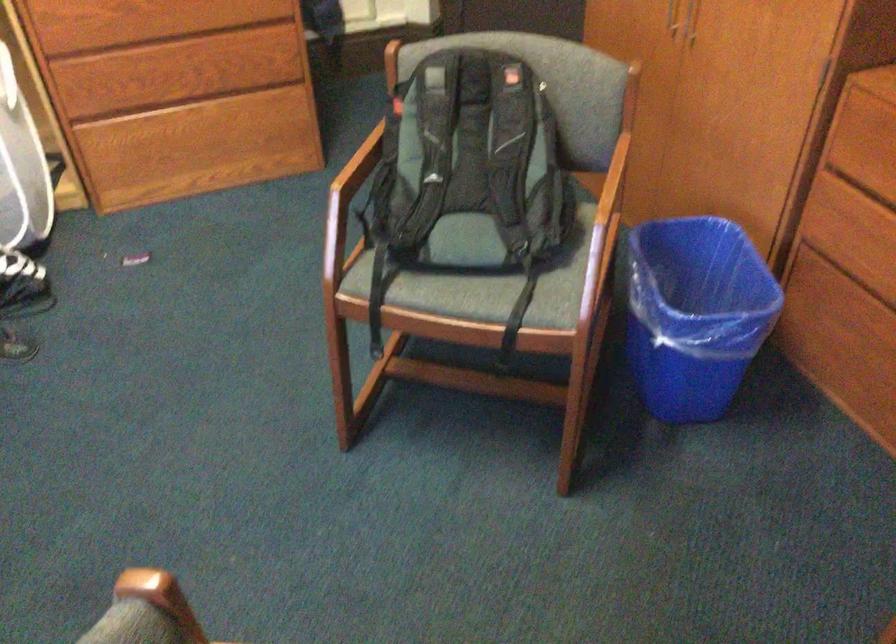
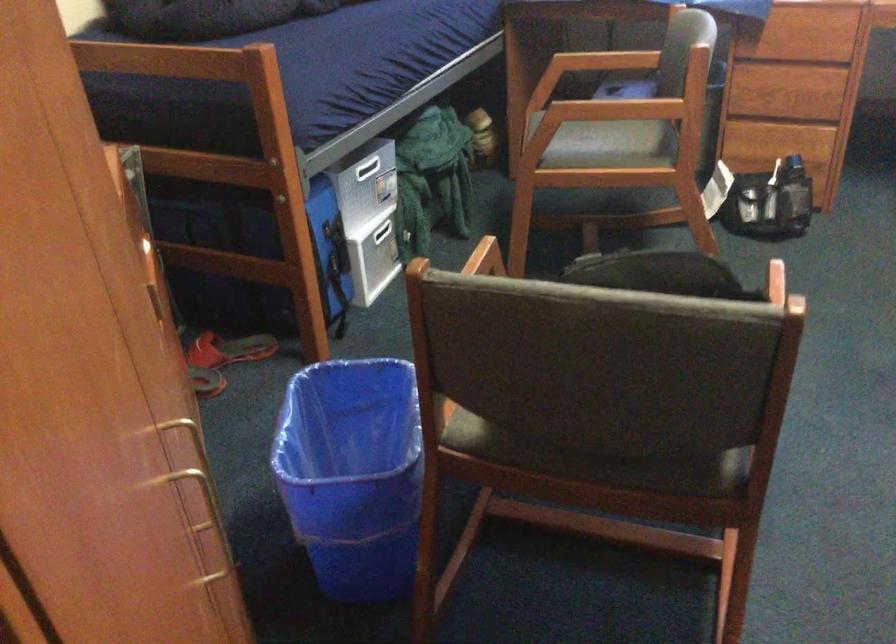
Where in the second image is the point corresponding to point 582,243 from the first image?

(487, 257)